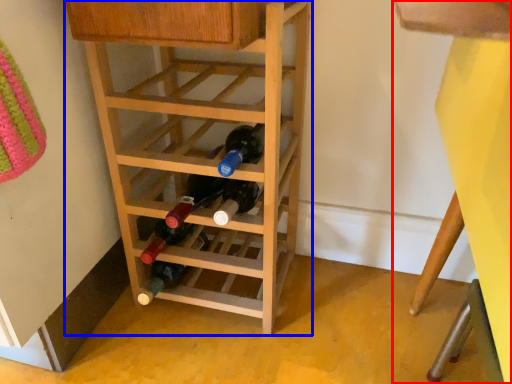
Question: Which point is closer to the camera, bunk bed (highlighted by a red box) or shelf (highlighted by a blue box)?

Choices:
 (A) bunk bed
 (B) shelf

Answer: (A)